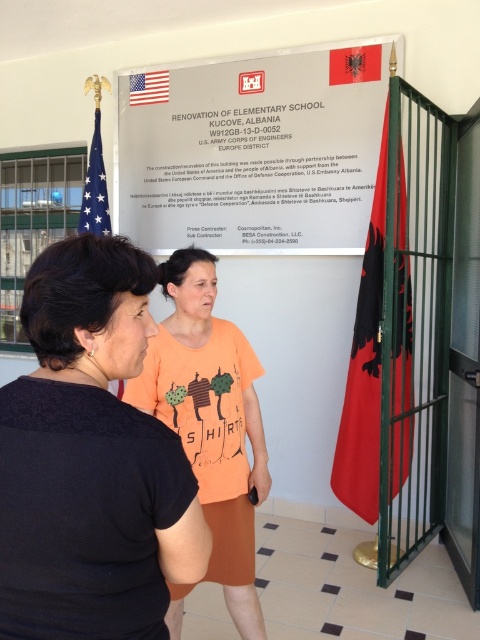
What is located at the coordinates point (x=255, y=154) in the image?

The point (x=255, y=154) corresponds to the white paper at center.

You are a photographer positioned in front of the two people. You want to take a photo that clearly shows both the white paper at center and the orange cotton shirt at center. Which object should you focus on first to ensure both are in focus?

The white paper at center is further to the viewer than the orange cotton shirt at center. To ensure both are in focus, you should focus on the white paper at center first, as it is closer, and the orange cotton shirt at center will naturally fall into focus if the depth of field is sufficient.